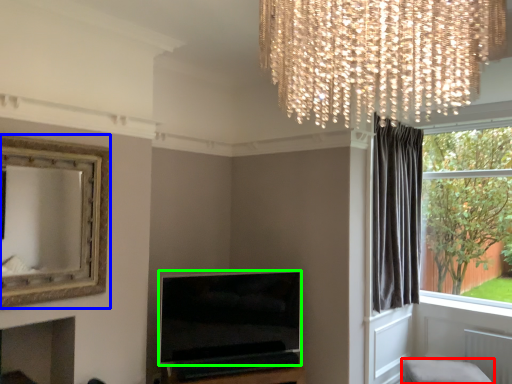
Question: Estimate the real-world distances between objects in this image. Which object is farther from furniture (highlighted by a red box), picture frame (highlighted by a blue box) or television (highlighted by a green box)?

Choices:
 (A) picture frame
 (B) television

Answer: (A)